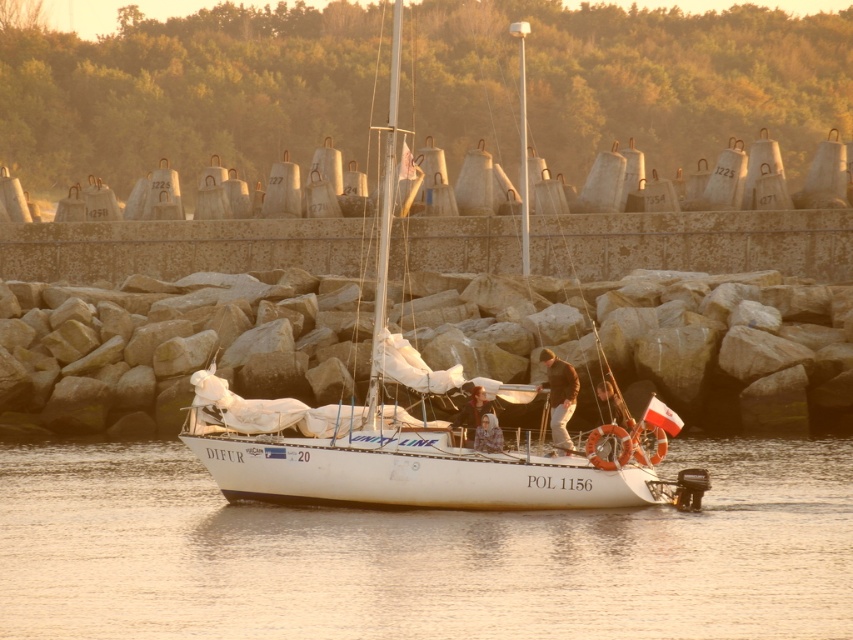
Question: Does brown leather jacket at center appear under smooth beige shirt at center?

Choices:
 (A) yes
 (B) no

Answer: (B)

Question: Which point is farther from the camera taking this photo?

Choices:
 (A) (496, 433)
 (B) (109, 512)

Answer: (B)

Question: Which point appears farthest from the camera in this image?

Choices:
 (A) (573, 396)
 (B) (489, 436)
 (C) (631, 586)

Answer: (A)

Question: Does white glossy water at center come behind smooth beige shirt at center?

Choices:
 (A) yes
 (B) no

Answer: (B)

Question: Is brown leather jacket at center behind smooth beige shirt at center?

Choices:
 (A) no
 (B) yes

Answer: (B)

Question: Based on their relative distances, which object is farther from the smooth beige shirt at center?

Choices:
 (A) white matte sailboat at center
 (B) white glossy water at center

Answer: (A)